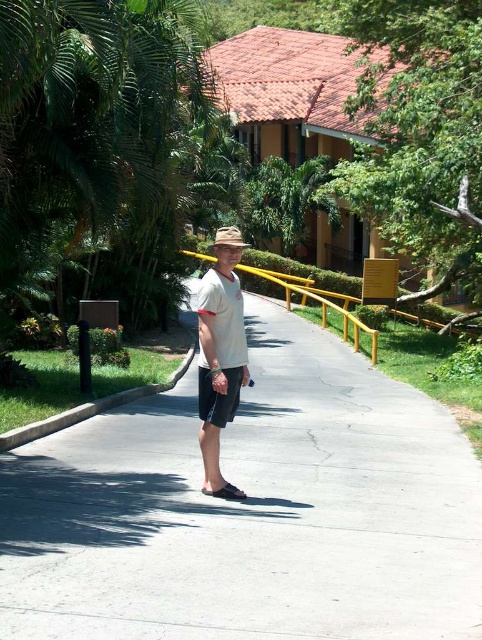
You are taking a photo of the man standing on the pathway. You want to focus on the point closer to the camera. Which point should you choose between point (x=322, y=323) and point (x=226, y=228)?

Point (x=322, y=323) is further to the camera than point (x=226, y=228), so you should choose point (x=322, y=323) to focus on the closer point.

You are a photographer trying to capture a wide shot of the man standing on the white concrete pavement at center and wearing the black cotton shorts at center. Since you want to focus on the man and his clothing, which object should you ensure is smaller in your photo?

The black cotton shorts at center should be smaller in the photo because the white concrete pavement at center is bigger, allowing the focus to remain on the man and his clothing.

You are a delivery person who needs to place a package on the ground near the black cotton shorts at center. The package must be placed exactly 10 feet away from the white concrete pavement at center. Is this possible given the current setup?

The white concrete pavement at center is 9.44 feet away from the black cotton shorts at center. Since the required distance is 10 feet, the package cannot be placed exactly 10 feet away from the white concrete pavement at center while also being near the black cotton shorts at center.